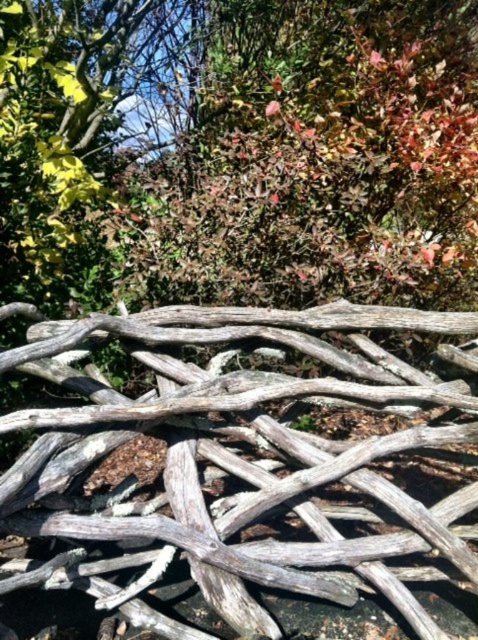
Looking at this image, you are standing in the natural outdoor scene with driftwood and autumn foliage. You notice two points marked in the image. The first point is at coordinates point (x=31, y=451) and the second is at point (x=334, y=20). Which point is nearer to you?

Point (x=31, y=451) is closer to the viewer than point (x=334, y=20).

You are standing in the natural outdoor scene and want to pick up the green matte leaves at upper center. Which direction should you move relative to the weathered wood at bottom?

The weathered wood at bottom is to the left of the green matte leaves at upper center, so to reach the green matte leaves at upper center, you should move to the right from the weathered wood at bottom.

You are an artist setting up your easel to paint the scene. You want to ensure the weathered wood at bottom and the green matte leaves at upper center are both visible in your painting. Considering their sizes, which object should you place closer to the foreground to maintain their visibility?

The weathered wood at bottom has a smaller size compared to green matte leaves at upper center. To maintain visibility of both, you should place the weathered wood at bottom closer to the foreground since smaller objects need to be nearer to appear prominent in the painting.